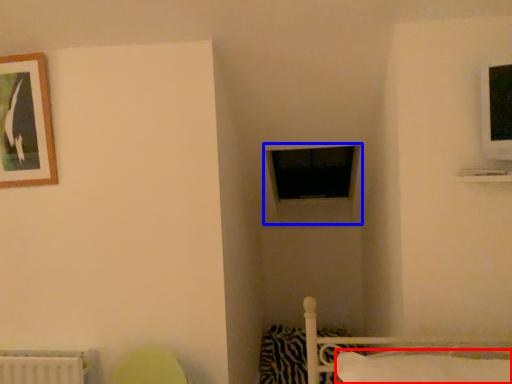
Question: Which object appears closest to the camera in this image, pillow (highlighted by a red box) or window frame (highlighted by a blue box)?

Choices:
 (A) pillow
 (B) window frame

Answer: (A)